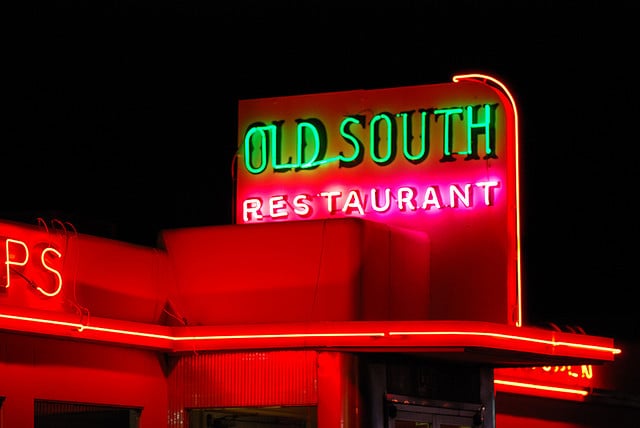
Identify the location of light shining through window. (250, 413).